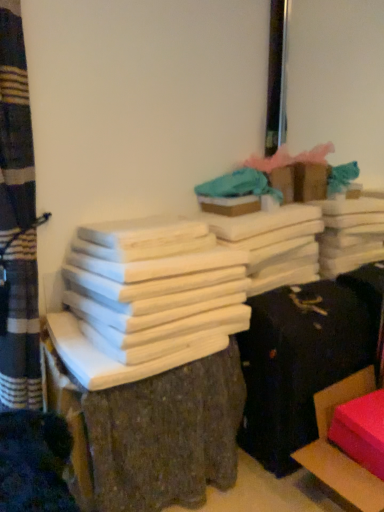
Question: Is white matte wood at center closer to the viewer compared to teal fabric at upper center?

Choices:
 (A) no
 (B) yes

Answer: (B)

Question: Considering the relative sizes of white matte wood at center and teal fabric at upper center in the image provided, is white matte wood at center wider than teal fabric at upper center?

Choices:
 (A) yes
 (B) no

Answer: (A)

Question: From a real-world perspective, is white matte wood at center beneath teal fabric at upper center?

Choices:
 (A) yes
 (B) no

Answer: (A)

Question: From a real-world perspective, does white matte wood at center stand above teal fabric at upper center?

Choices:
 (A) no
 (B) yes

Answer: (A)

Question: Could you tell me if white matte wood at center is turned towards teal fabric at upper center?

Choices:
 (A) yes
 (B) no

Answer: (B)

Question: From the image's perspective, would you say white matte wood at center is shown under teal fabric at upper center?

Choices:
 (A) no
 (B) yes

Answer: (B)

Question: From a real-world perspective, is rubberized pink cushion at lower right, the 2th furniture in the left-to-right sequence, under teal fabric at upper center?

Choices:
 (A) yes
 (B) no

Answer: (A)

Question: Is teal fabric at upper center at the back of rubberized pink cushion at lower right, the 2th furniture in the left-to-right sequence?

Choices:
 (A) no
 (B) yes

Answer: (A)

Question: Does rubberized pink cushion at lower right, the 2th furniture in the left-to-right sequence, appear on the left side of teal fabric at upper center?

Choices:
 (A) no
 (B) yes

Answer: (A)

Question: Is rubberized pink cushion at lower right, the 2th furniture in the left-to-right sequence, completely or partially outside of teal fabric at upper center?

Choices:
 (A) yes
 (B) no

Answer: (A)

Question: From the image's perspective, is rubberized pink cushion at lower right, the 2th furniture in the left-to-right sequence, over teal fabric at upper center?

Choices:
 (A) yes
 (B) no

Answer: (B)

Question: Is the surface of rubberized pink cushion at lower right, arranged as the first furniture when viewed from the right, in direct contact with teal fabric at upper center?

Choices:
 (A) no
 (B) yes

Answer: (A)

Question: Could you tell me if smooth wood stack at center, acting as the 2th furniture starting from the right, is turned towards white matte wood at center?

Choices:
 (A) yes
 (B) no

Answer: (B)